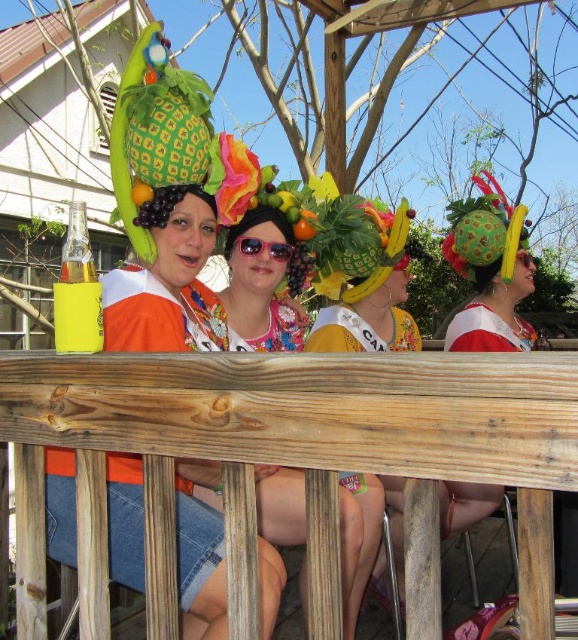
You are a photographer standing at a certain distance from the scene. You want to capture a clear photo of the floral fabric dress at center without including the other people in the background. Given that the camera you are using has a maximum focus range of 1.6 meters, will you be able to take the photo clearly?

The floral fabric dress at center is 1.71 meters away from the viewer. Since the camera can only focus up to 1.6 meters, the dress is slightly out of the camera s maximum focus range, making it difficult to capture a clear photo without adjusting your position or equipment.

You are standing at the origin of the coordinate system in this image. There is a point at coordinates [260,291]. What object is located at that point?

The point at coordinates [260,291] is where the floral fabric dress at center is located.

In the festive scene with four people on a wooden railing, you need to choose between placing a decorative item on either the floral fabric dress at center or the orange matte at center. Which object would be more suitable for a larger decoration?

The floral fabric dress at center is bigger than the orange matte at center, so it would be more suitable for a larger decoration.